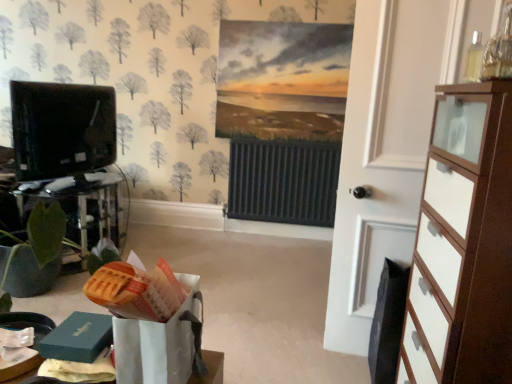
What is the approximate height of white glossy chest of drawers at right?

3.79 feet.

Identify the location of white wood door at right. This screenshot has height=384, width=512. (382, 154).

Locate an element on the screen. white glossy chest of drawers at right is located at coordinates (463, 243).

Considering the sizes of objects black glossy tv at left and white glossy chest of drawers at right in the image provided, who is taller, black glossy tv at left or white glossy chest of drawers at right?

white glossy chest of drawers at right is taller.

From the image's perspective, is black glossy tv at left below white glossy chest of drawers at right?

Actually, black glossy tv at left appears above white glossy chest of drawers at right in the image.

Which is in front, point (71, 171) or point (418, 304)?

Positioned in front is point (418, 304).

Can you confirm if black glossy tv at left is smaller than white glossy chest of drawers at right?

Yes.

Is white wood door at right turned away from white glossy chest of drawers at right?

white wood door at right does not have its back to white glossy chest of drawers at right.

This screenshot has width=512, height=384. I want to click on the chest of drawers lying in front of the white wood door at right, so click(x=463, y=243).

Which is more to the right, white wood door at right or white glossy chest of drawers at right?

Positioned to the right is white glossy chest of drawers at right.

From the image's perspective, is white wood door at right below white glossy chest of drawers at right?

No, from the image's perspective, white wood door at right is not below white glossy chest of drawers at right.

Which of these two, white glossy chest of drawers at right or white wood door at right, is thinner?

With smaller width is white wood door at right.

Is white wood door at right at the back of white glossy chest of drawers at right?

white glossy chest of drawers at right is not turned away from white wood door at right.

Which object is further away from the camera, white glossy chest of drawers at right or white wood door at right?

Positioned behind is white wood door at right.

Which is behind, white glossy chest of drawers at right or black glossy tv at left?

Positioned behind is black glossy tv at left.

Is white glossy chest of drawers at right touching black glossy tv at left?

No, white glossy chest of drawers at right is not with black glossy tv at left.

Considering the sizes of white glossy chest of drawers at right and black glossy tv at left in the image, is white glossy chest of drawers at right wider or thinner than black glossy tv at left?

Considering their sizes, white glossy chest of drawers at right looks broader than black glossy tv at left.

From the image's perspective, is white glossy chest of drawers at right above or below black glossy tv at left?

From the image's perspective, white glossy chest of drawers at right appears below black glossy tv at left.

From the image's perspective, does white wood door at right appear higher than black glossy tv at left?

No, from the image's perspective, white wood door at right is not on top of black glossy tv at left.

Considering the sizes of objects white wood door at right and black glossy tv at left in the image provided, who is bigger, white wood door at right or black glossy tv at left?

Bigger between the two is white wood door at right.

Is white wood door at right in front of black glossy tv at left?

Yes, white wood door at right is closer to the camera.

Which of these two, white wood door at right or black glossy tv at left, is wider?

black glossy tv at left.

Find the location of a particular element. door on the right of the black glossy tv at left is located at coordinates (382, 154).

Would you say black glossy tv at left is inside or outside white wood door at right?

black glossy tv at left is not enclosed by white wood door at right.

From the image's perspective, who appears lower, black glossy tv at left or white wood door at right?

white wood door at right, from the image's perspective.

Can you confirm if black glossy tv at left is thinner than white wood door at right?

In fact, black glossy tv at left might be wider than white wood door at right.

The width and height of the screenshot is (512, 384). What are the coordinates of `electronic above the white glossy chest of drawers at right (from a real-world perspective)` in the screenshot? It's located at (62, 129).

Locate an element on the screen. The height and width of the screenshot is (384, 512). door above the white glossy chest of drawers at right (from the image's perspective) is located at coordinates (382, 154).

Looking at the image, which one is located closer to white glossy chest of drawers at right, white wood door at right or black glossy tv at left?

white wood door at right is positioned closer to the anchor white glossy chest of drawers at right.

When comparing their distances from white glossy chest of drawers at right, does black glossy tv at left or white wood door at right seem closer?

The object closer to white glossy chest of drawers at right is white wood door at right.

Based on their spatial positions, is white glossy chest of drawers at right or white wood door at right further from black glossy tv at left?

white glossy chest of drawers at right lies further to black glossy tv at left than the other object.

From the image, which object appears to be nearer to white wood door at right, black glossy tv at left or white glossy chest of drawers at right?

white glossy chest of drawers at right lies closer to white wood door at right than the other object.

Which object lies nearer to the anchor point black glossy tv at left, white wood door at right or white glossy chest of drawers at right?

The object closer to black glossy tv at left is white wood door at right.

When comparing their distances from white wood door at right, does white glossy chest of drawers at right or black glossy tv at left seem further?

black glossy tv at left lies further to white wood door at right than the other object.

The width and height of the screenshot is (512, 384). Identify the location of door situated between black glossy tv at left and white glossy chest of drawers at right from left to right. (382, 154).